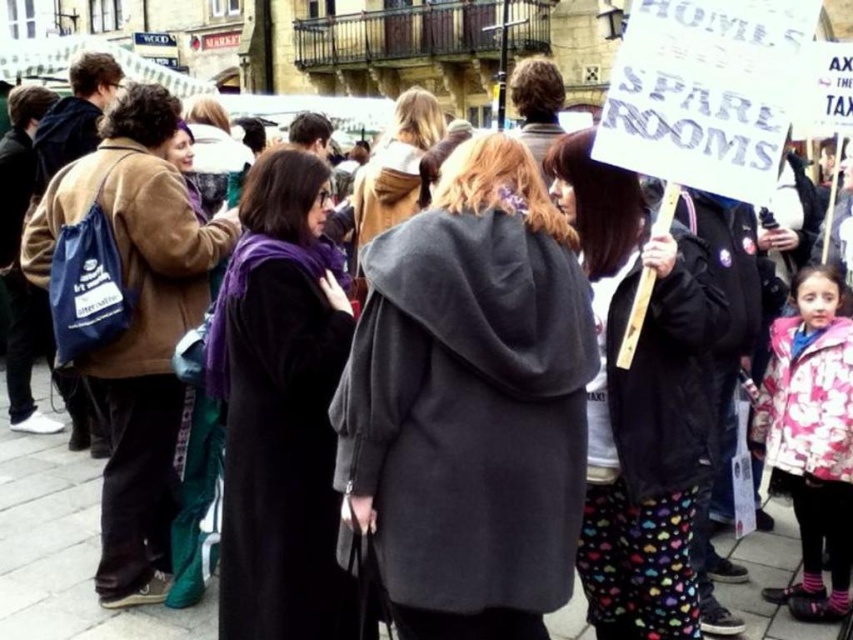
You are a photographer standing in the town square and want to capture both the point at coordinates point (305, 176) and point (415, 131) in your photo. Which point will appear larger in your photo?

Point (305, 176) is closer to the viewer than point (415, 131), so it will appear larger in the photo.

You are a photographer at the protest and want to capture both the purple velvet scarf at center and the gray wool coat at center in a single photo. Based on their positions, which one should you focus on first to ensure both are in frame?

The purple velvet scarf at center is located below the gray wool coat at center. To capture both in a single photo, focus on the gray wool coat at center first as it is higher up, then adjust the frame to include the purple velvet scarf at center below it.

You are a drone operator trying to capture a photo of the crowd holding signs in the town square. The drone is currently at the point marked as point (241,280). What is the minimum distance the drone needs to move to ensure all signs are in frame?

The minimum distance the drone needs to move is 41.02 meters to ensure all signs are in frame.